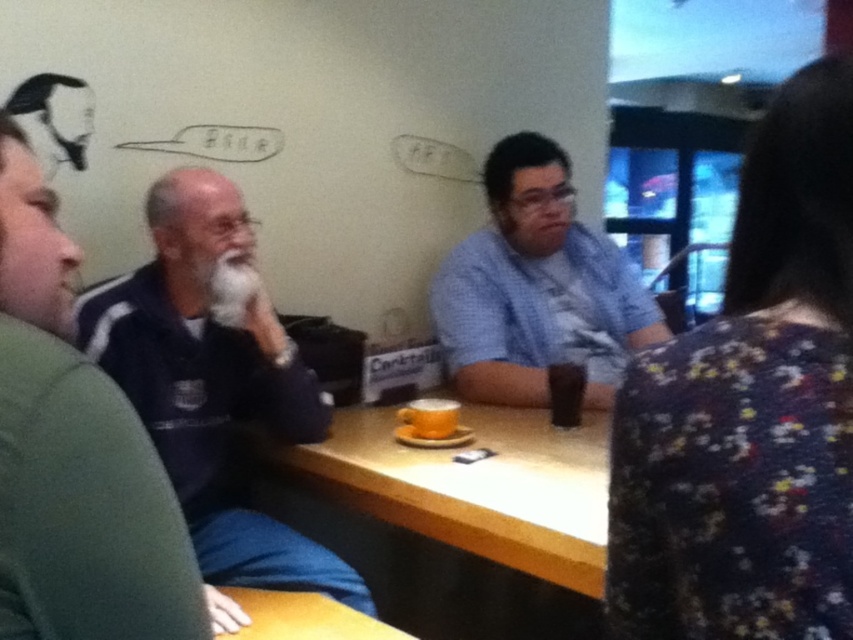
Question: Which object appears farthest from the camera in this image?

Choices:
 (A) dark brown liquid at table center
 (B) dark blue fabric at left
 (C) wooden table at center

Answer: (A)

Question: Can you confirm if blue checkered shirt at center is positioned to the left of dark brown liquid at table center?

Choices:
 (A) yes
 (B) no

Answer: (B)

Question: Can you confirm if dark blue fabric at left is positioned below blue checkered shirt at center?

Choices:
 (A) yes
 (B) no

Answer: (A)

Question: Which point appears farthest from the camera in this image?

Choices:
 (A) (494, 211)
 (B) (402, 636)
 (C) (534, 428)

Answer: (A)

Question: Which point is farther to the camera?

Choices:
 (A) wooden table at center
 (B) blue checkered shirt at center

Answer: (B)

Question: In this image, where is dark blue fabric at left located relative to wooden table at lower center?

Choices:
 (A) below
 (B) above

Answer: (B)